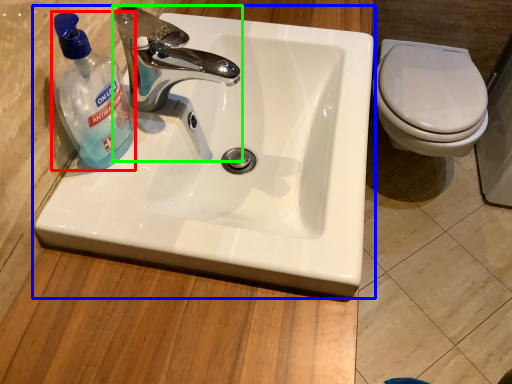
Question: Based on their relative distances, which object is farther from cleaning product (highlighted by a red box)? Choose from sink (highlighted by a blue box) and tap (highlighted by a green box).

Choices:
 (A) sink
 (B) tap

Answer: (A)